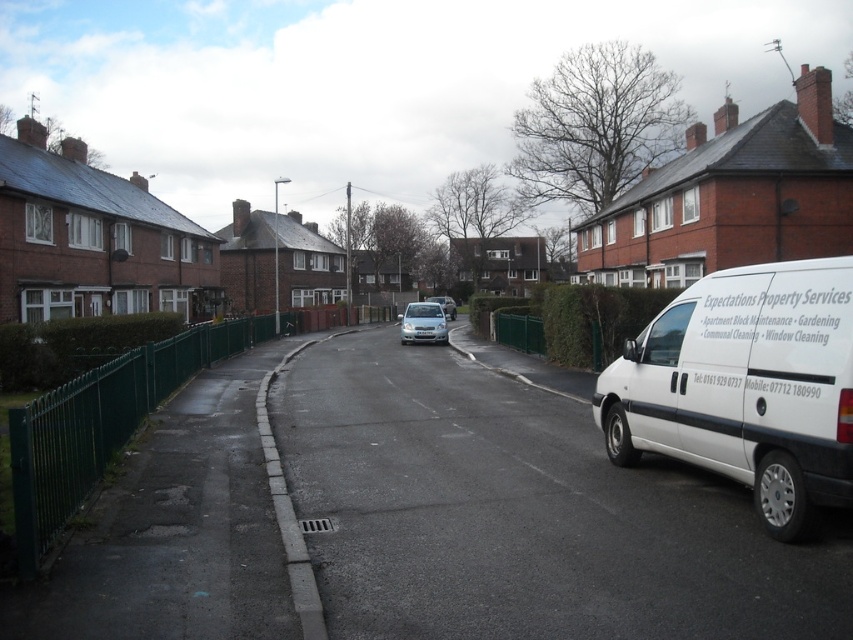
You are a delivery person standing at the point marked by the coordinates point (444, 305). Which vehicle are you closest to?

The point (444, 305) indicates the satin silver van at center, so you are closest to the satin silver van at center.

You are a delivery driver who needs to park your 1.8 meters tall delivery box on the street. You see the satin silver car at center and the white plastic license plate at center. Which object can the delivery box fit under without hitting the top?

The satin silver car at center has a greater height compared to the white plastic license plate at center. Since the delivery box is 1.8 meters tall, it can fit under the satin silver car at center but not under the white plastic license plate at center due to the height difference.